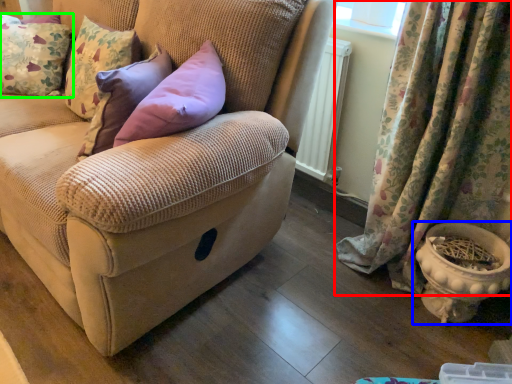
Question: Estimate the real-world distances between objects in this image. Which object is closer to curtain (highlighted by a red box), flowerpot (highlighted by a blue box) or pillow (highlighted by a green box)?

Choices:
 (A) flowerpot
 (B) pillow

Answer: (A)